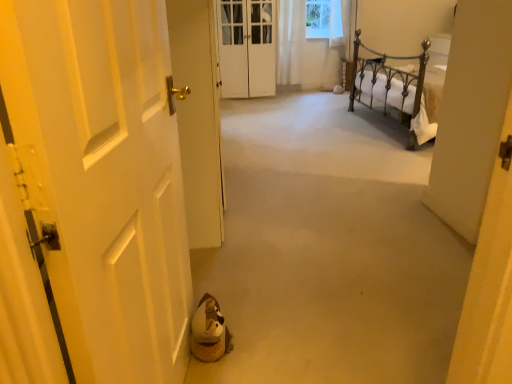
At what (x,y) coordinates should I click in order to perform the action: click on free region under white sheer curtain at upper center (from a real-world perspective). Please return your answer as a coordinate pair (x, y). Image resolution: width=512 pixels, height=384 pixels. Looking at the image, I should click on (291, 94).